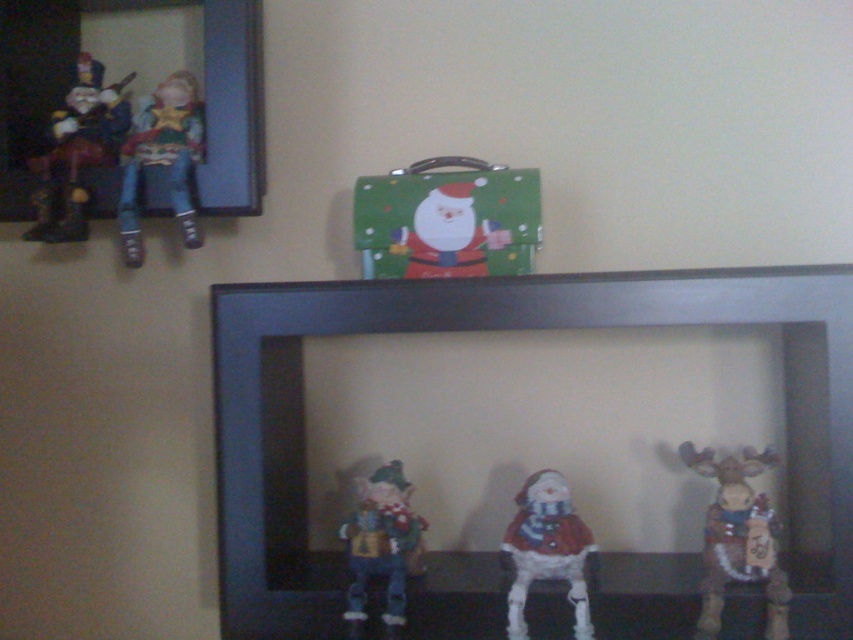
Is point (238, 26) positioned after point (35, 209)?

No, (238, 26) is closer to viewer.

From the picture: Does wooden frame at upper left appear on the left side of wooden horse at upper left?

In fact, wooden frame at upper left is to the right of wooden horse at upper left.

This screenshot has height=640, width=853. What are the coordinates of `wooden frame at upper left` in the screenshot? It's located at (71, 76).

Which is more to the right, black matte picture frame at center or wooden horse at upper left?

Positioned to the right is black matte picture frame at center.

Is point (498, 310) positioned after point (90, 54)?

No, (498, 310) is closer to viewer.

I want to click on black matte picture frame at center, so click(508, 330).

From the picture: Which of these two, wooden horse at upper left or matte plastic pig at center, stands taller?

wooden horse at upper left

Is wooden horse at upper left below matte plastic pig at center?

Actually, wooden horse at upper left is above matte plastic pig at center.

Which is in front, point (74, 84) or point (376, 529)?

Point (376, 529) is in front.

At what (x,y) coordinates should I click in order to perform the action: click on wooden horse at upper left. Please return your answer as a coordinate pair (x, y). Looking at the image, I should click on (76, 150).